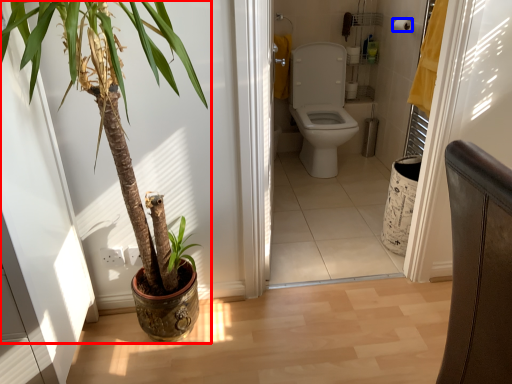
Question: Which point is closer to the camera, houseplant (highlighted by a red box) or toilet paper (highlighted by a blue box)?

Choices:
 (A) houseplant
 (B) toilet paper

Answer: (A)